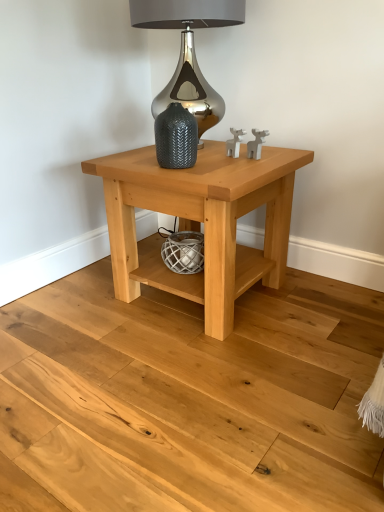
Question: Is textured gray vase at center wider or thinner than satin silver lamp at upper center?

Choices:
 (A) thin
 (B) wide

Answer: (A)

Question: From a real-world perspective, is textured gray vase at center above or below satin silver lamp at upper center?

Choices:
 (A) below
 (B) above

Answer: (A)

Question: Which object is the closest to the natural wood floor at lower center?

Choices:
 (A) white textured basket at lower center
 (B) textured gray vase at center
 (C) satin silver lamp at upper center
 (D) natural wood table at center

Answer: (D)

Question: Which is nearer to the natural wood floor at lower center?

Choices:
 (A) satin silver lamp at upper center
 (B) textured gray vase at center
 (C) white textured basket at lower center
 (D) natural wood table at center

Answer: (D)